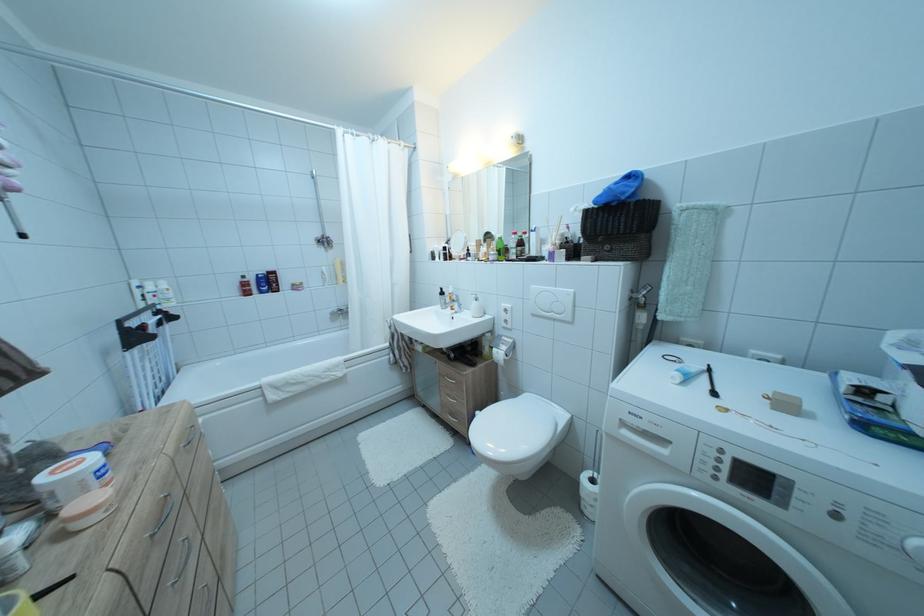
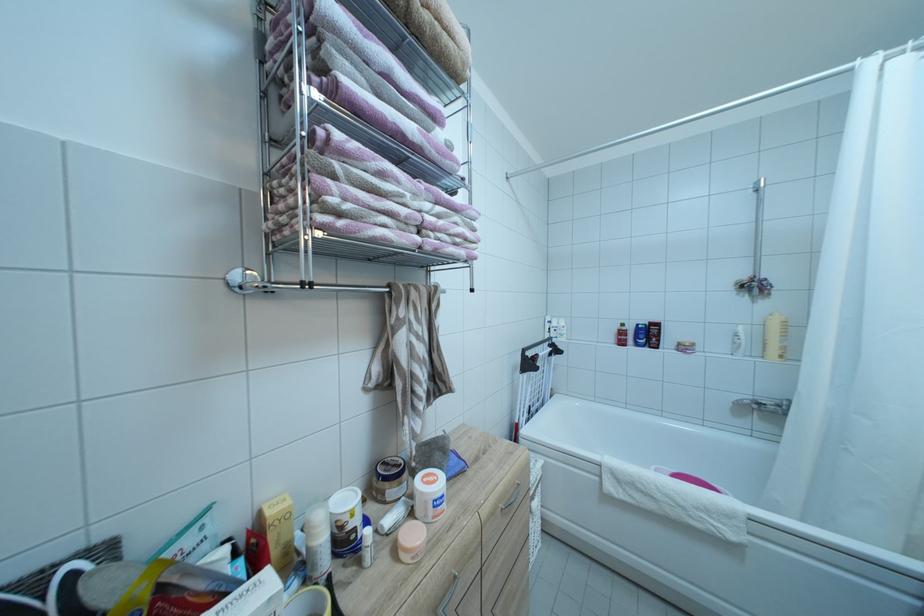
In the second image, find the point that corresponds to (348,315) in the first image.

(767, 410)